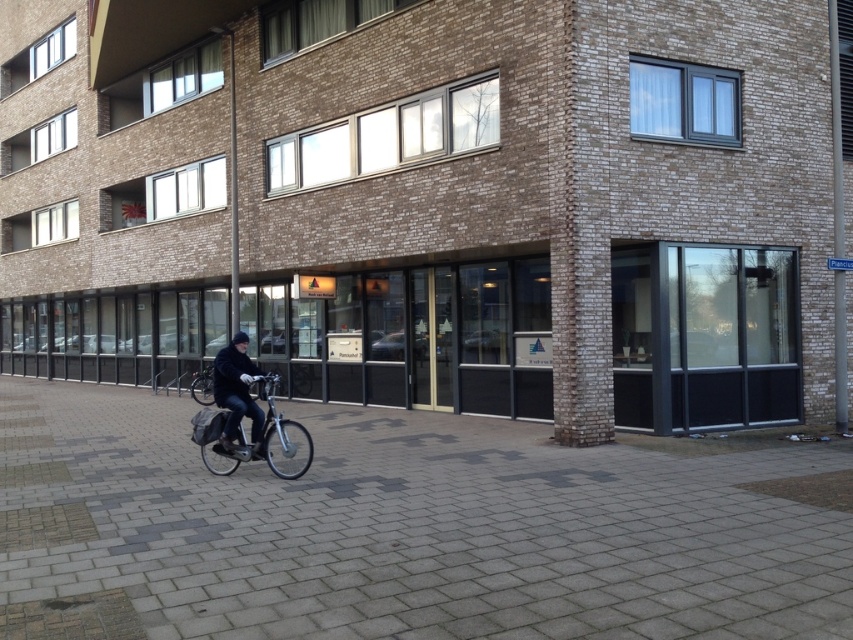
Can you confirm if silver metallic bicycle at lower left is thinner than dark blue jacket at center?

No.

Identify the location of silver metallic bicycle at lower left. (254, 440).